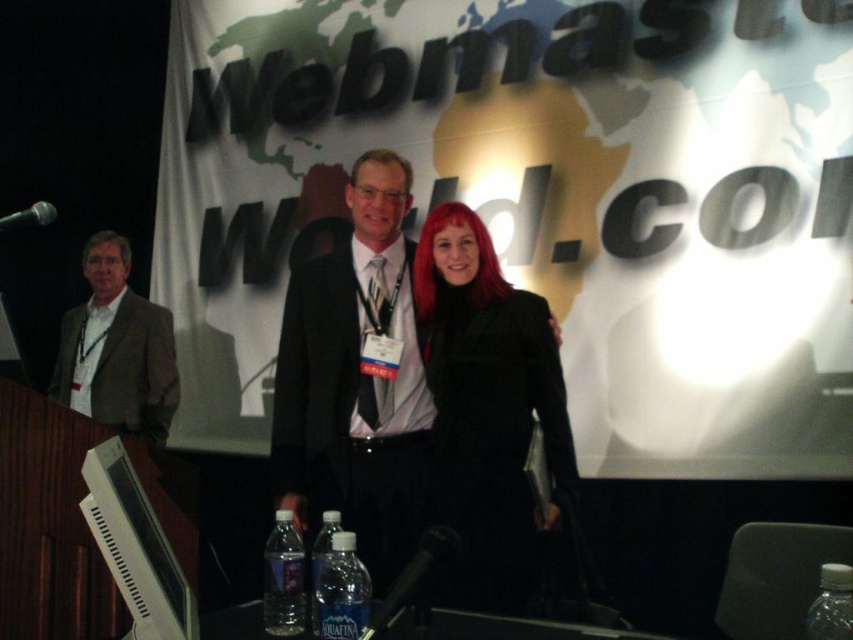
Question: Is transparent plastic bottle at center behind clear plastic water bottle at center?

Choices:
 (A) no
 (B) yes

Answer: (A)

Question: Does black matte suit at center lie behind clear plastic bottle at lower center?

Choices:
 (A) no
 (B) yes

Answer: (B)

Question: Can you confirm if black satin suit at center is smaller than clear plastic bottle at lower center?

Choices:
 (A) no
 (B) yes

Answer: (A)

Question: Which object is closer to the camera taking this photo?

Choices:
 (A) black suit at center
 (B) black matte suit at center
 (C) clear plastic water bottle at center
 (D) brown fabric suit at left

Answer: (C)

Question: Which of these objects is positioned farthest from the brown fabric suit at left?

Choices:
 (A) clear plastic water bottle at center
 (B) clear plastic bottle at lower center
 (C) black satin suit at center
 (D) clear plastic water bottle at lower center

Answer: (D)

Question: Which object appears farthest from the camera in this image?

Choices:
 (A) black satin suit at center
 (B) clear plastic water bottle at lower center

Answer: (A)